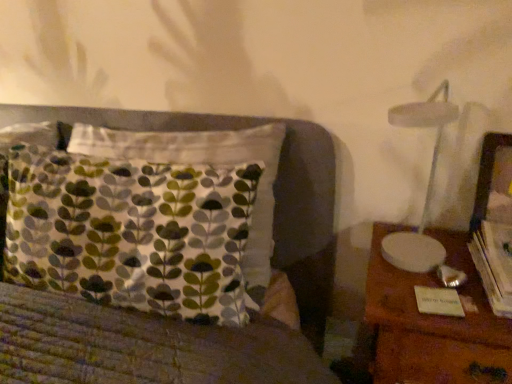
Question: Is wooden picture frame at right bigger than hardcover book at right?

Choices:
 (A) yes
 (B) no

Answer: (A)

Question: Considering the relative sizes of wooden picture frame at right and hardcover book at right in the image provided, is wooden picture frame at right shorter than hardcover book at right?

Choices:
 (A) no
 (B) yes

Answer: (A)

Question: Is wooden picture frame at right thinner than hardcover book at right?

Choices:
 (A) no
 (B) yes

Answer: (B)

Question: From a real-world perspective, is wooden picture frame at right physically above hardcover book at right?

Choices:
 (A) yes
 (B) no

Answer: (A)

Question: From the image's perspective, is wooden picture frame at right below hardcover book at right?

Choices:
 (A) no
 (B) yes

Answer: (A)

Question: Can you confirm if wooden picture frame at right is positioned to the left of hardcover book at right?

Choices:
 (A) no
 (B) yes

Answer: (A)

Question: Does hardcover book at right have a larger size compared to wooden picture frame at right?

Choices:
 (A) no
 (B) yes

Answer: (A)

Question: Is hardcover book at right facing towards wooden picture frame at right?

Choices:
 (A) no
 (B) yes

Answer: (A)

Question: Does hardcover book at right appear on the right side of wooden picture frame at right?

Choices:
 (A) yes
 (B) no

Answer: (B)

Question: Would you say hardcover book at right contains wooden picture frame at right?

Choices:
 (A) yes
 (B) no

Answer: (B)

Question: Can you confirm if hardcover book at right is shorter than wooden picture frame at right?

Choices:
 (A) yes
 (B) no

Answer: (A)

Question: Is hardcover book at right outside wooden picture frame at right?

Choices:
 (A) no
 (B) yes

Answer: (B)

Question: Is wooden nightstand at right at the right side of hardcover book at right?

Choices:
 (A) no
 (B) yes

Answer: (A)